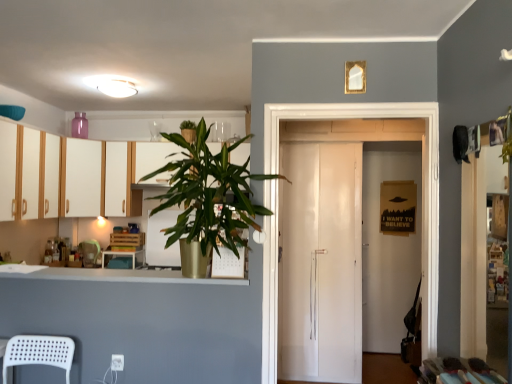
Question: In terms of width, does green leafy plant at upper center look wider or thinner when compared to white wood cabinets at left, which is the second cabinetry from left to right?

Choices:
 (A) thin
 (B) wide

Answer: (A)

Question: Is green leafy plant at upper center inside the boundaries of white wood cabinets at left, acting as the 2th cabinetry starting from the back, or outside?

Choices:
 (A) inside
 (B) outside

Answer: (B)

Question: Estimate the real-world distances between objects in this image. Which object is farther from the white wood cabinets at left, acting as the first cabinetry starting from the front?

Choices:
 (A) white glossy door at center
 (B) matte wood table at center
 (C) white plastic chair at lower left
 (D) green leafy plant at upper center
 (E) white glossy refrigerator at center

Answer: (A)

Question: Based on their relative distances, which object is nearer to the matte white cabinet at upper left, the first cabinetry viewed from the back?

Choices:
 (A) white glossy refrigerator at center
 (B) matte wood table at center
 (C) white plastic chair at lower left
 (D) green leafy plant at upper center
 (E) white glossy door at center

Answer: (A)